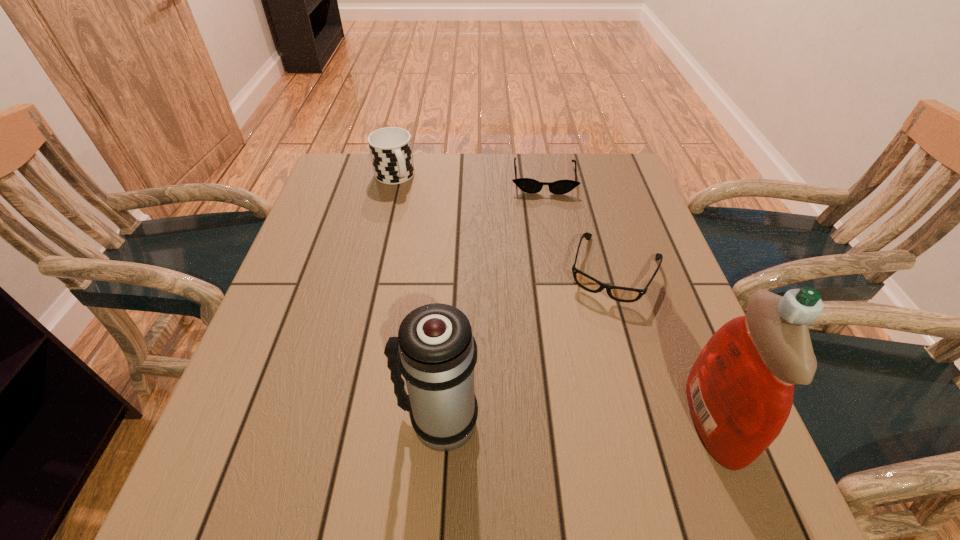
This screenshot has width=960, height=540. Identify the location of the fourth object from right to left. (435, 351).

Locate an element on the screen. This screenshot has width=960, height=540. thermos bottle is located at coordinates (435, 351).

Where is `the tallest object`? The width and height of the screenshot is (960, 540). the tallest object is located at coordinates (740, 390).

The image size is (960, 540). I want to click on the shortest object, so click(x=528, y=185).

This screenshot has height=540, width=960. I want to click on the leftmost object, so click(x=390, y=148).

Locate an element on the screen. This screenshot has height=540, width=960. the third shortest object is located at coordinates (390, 148).

At what (x,y) coordinates should I click in order to perform the action: click on the third farthest object. Please return your answer as a coordinate pair (x, y). This screenshot has width=960, height=540. Looking at the image, I should click on (622, 294).

This screenshot has height=540, width=960. What are the coordinates of `vacant region located 0.250m on the side with the handle of the fourth shortest object` in the screenshot? It's located at (256, 421).

Where is `free region located 0.060m on the side with the handle of the fourth shortest object`? The image size is (960, 540). free region located 0.060m on the side with the handle of the fourth shortest object is located at coordinates (366, 421).

Where is `vacant space situated 0.150m on the side with the handle of the fourth shortest object`? The width and height of the screenshot is (960, 540). vacant space situated 0.150m on the side with the handle of the fourth shortest object is located at coordinates (314, 421).